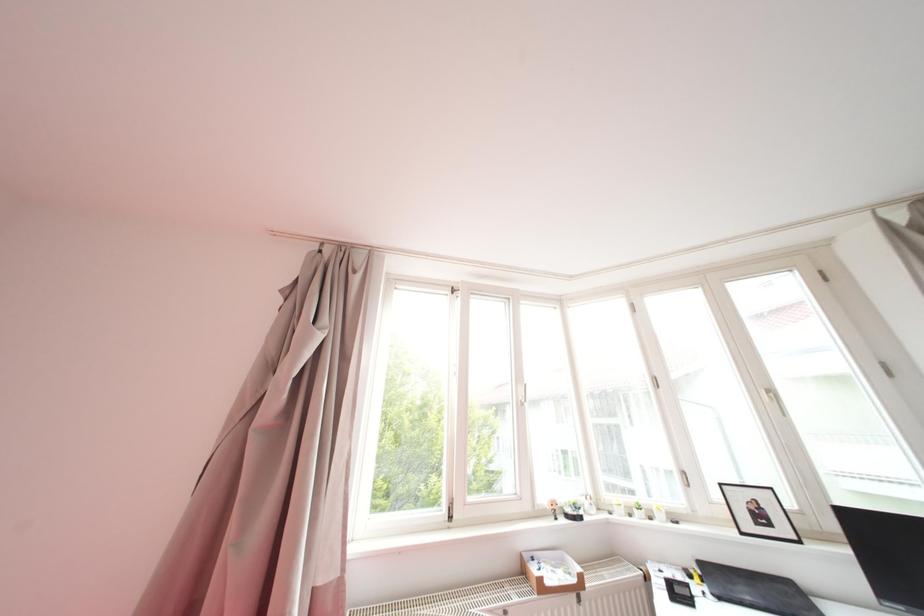
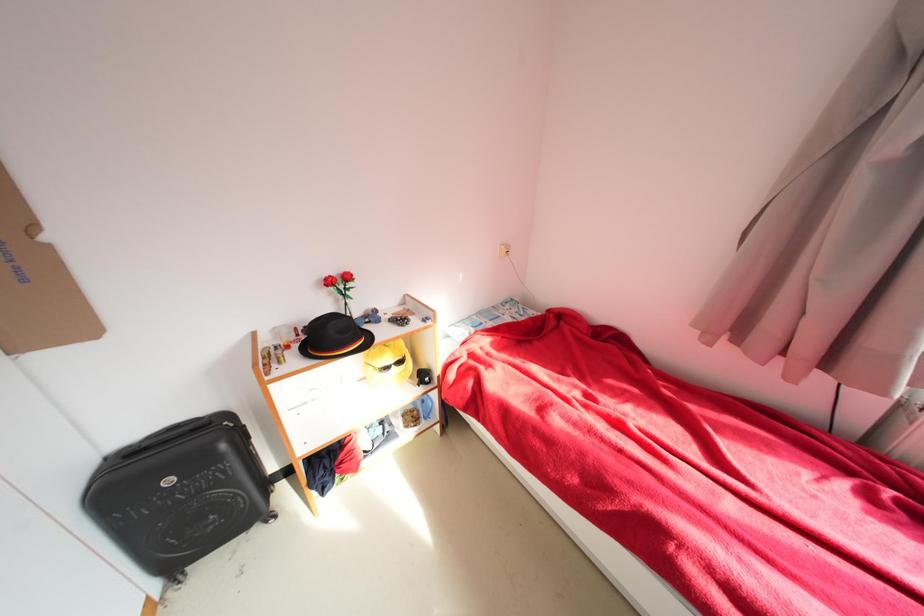
The images are taken continuously from a first-person perspective. In which direction is your viewpoint rotating?

The camera rotated toward left-down.